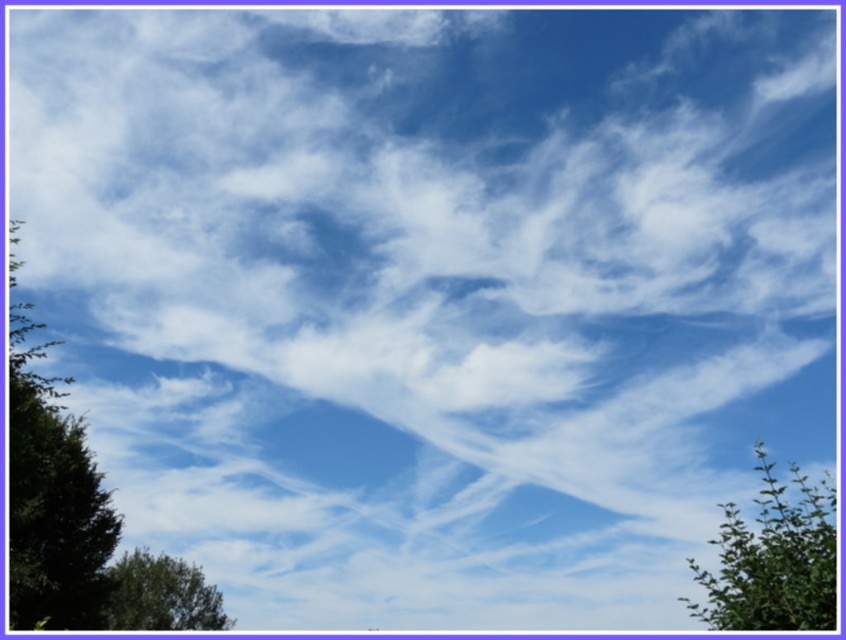
Does point (810, 611) lie behind point (169, 621)?

No, (810, 611) is closer to viewer.

Is point (806, 584) in front of point (125, 624)?

Yes, it is.

Does point (795, 518) come in front of point (165, 616)?

Yes, point (795, 518) is in front of point (165, 616).

Find the location of a particular element. This screenshot has height=640, width=846. green leafy tree at lower right is located at coordinates (773, 560).

Based on the photo, does green leafy tree at left have a lesser width compared to green leafy tree at lower right?

No, green leafy tree at left is not thinner than green leafy tree at lower right.

Measure the distance between point (92, 586) and camera.

A distance of 33.98 meters exists between point (92, 586) and camera.

Locate an element on the screen. Image resolution: width=846 pixels, height=640 pixels. green leafy tree at left is located at coordinates (51, 499).

This screenshot has width=846, height=640. Describe the element at coordinates (51, 499) in the screenshot. I see `green leafy tree at left` at that location.

Who is more distant from viewer, (89, 528) or (168, 566)?

The point (168, 566) is behind.

Identify the location of green leafy tree at left. This screenshot has height=640, width=846. (51, 499).